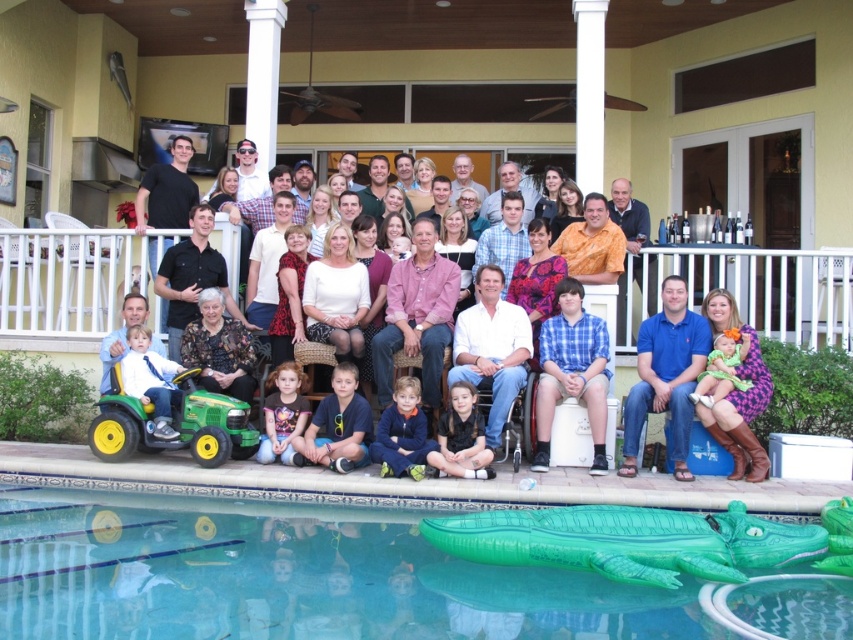
Which of these two, blue cotton shirt at lower right or dark blue fleece at center, stands shorter?

Standing shorter between the two is dark blue fleece at center.

Can you confirm if blue cotton shirt at lower right is positioned above dark blue fleece at center?

Correct, blue cotton shirt at lower right is located above dark blue fleece at center.

At what (x,y) coordinates should I click in order to perform the action: click on blue cotton shirt at lower right. Please return your answer as a coordinate pair (x, y). Looking at the image, I should click on (666, 374).

Can you confirm if white wicker basket at center is positioned above black matte dress at center?

Yes.

Which is in front, point (61, 276) or point (462, 445)?

Point (462, 445) is in front.

This screenshot has height=640, width=853. Identify the location of white wicker basket at center. (65, 282).

The height and width of the screenshot is (640, 853). In order to click on white wicker basket at center in this screenshot , I will do `click(65, 282)`.

Does green inflatable crocodile at lower center have a greater height compared to blue plaid shirt at center?

No.

Is green inflatable crocodile at lower center shorter than blue plaid shirt at center?

Yes.

The image size is (853, 640). What are the coordinates of `green inflatable crocodile at lower center` in the screenshot? It's located at (289, 577).

Where is `green inflatable crocodile at lower center`? This screenshot has height=640, width=853. green inflatable crocodile at lower center is located at coordinates (289, 577).